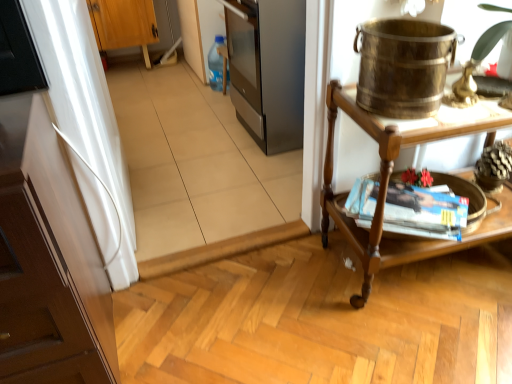
Locate an element on the screen. Image resolution: width=512 pixels, height=384 pixels. white glossy cabinet at left, which is counted as the 1th cabinetry, starting from the right is located at coordinates (48, 260).

Find the location of a particular element. The image size is (512, 384). wooden cabinet at upper left, marked as the 1th cabinetry in a back-to-front arrangement is located at coordinates (124, 24).

From a real-world perspective, is wooden table at right on top of matte brown magazine at right?

Yes, from a real-world perspective, wooden table at right is above matte brown magazine at right.

Can you confirm if wooden table at right is shorter than matte brown magazine at right?

In fact, wooden table at right may be taller than matte brown magazine at right.

From the image's perspective, is wooden table at right under matte brown magazine at right?

No, from the image's perspective, wooden table at right is not beneath matte brown magazine at right.

Between wooden table at right and matte brown magazine at right, which one appears on the left side from the viewer's perspective?

From the viewer's perspective, matte brown magazine at right appears more on the left side.

Can you tell me how much matte brown magazine at right and white glossy cabinet at left, which is the 2th cabinetry from top to bottom, differ in facing direction?

40 degrees.

Where is `the 2nd cabinetry directly above the matte brown magazine at right (from a real-world perspective)`? The height and width of the screenshot is (384, 512). the 2nd cabinetry directly above the matte brown magazine at right (from a real-world perspective) is located at coordinates (48, 260).

Would you say matte brown magazine at right is a long distance from white glossy cabinet at left, acting as the first cabinetry starting from the front?

No, matte brown magazine at right is not far away from white glossy cabinet at left, acting as the first cabinetry starting from the front.

How distant is matte brown magazine at right from white glossy cabinet at left, which is the 2th cabinetry from top to bottom?

matte brown magazine at right and white glossy cabinet at left, which is the 2th cabinetry from top to bottom, are 87.89 centimeters apart.

The height and width of the screenshot is (384, 512). What are the coordinates of `magazine located behind the brass metallic bucket at upper right` in the screenshot? It's located at (424, 211).

In terms of size, does brass metallic bucket at upper right appear bigger or smaller than matte brown magazine at right?

Considering their sizes, brass metallic bucket at upper right takes up more space than matte brown magazine at right.

From the picture: Does brass metallic bucket at upper right turn towards matte brown magazine at right?

No.

From a real-world perspective, is white glossy cabinet at left, which is the 2th cabinetry from top to bottom, physically located above or below matte brown magazine at right?

white glossy cabinet at left, which is the 2th cabinetry from top to bottom, is above matte brown magazine at right.

Is white glossy cabinet at left, the 2th cabinetry from the left, taller or shorter than matte brown magazine at right?

In the image, white glossy cabinet at left, the 2th cabinetry from the left, appears to be taller than matte brown magazine at right.

Is there a large distance between white glossy cabinet at left, acting as the first cabinetry starting from the front, and matte brown magazine at right?

white glossy cabinet at left, acting as the first cabinetry starting from the front, is near matte brown magazine at right, not far away.

In the image, is white glossy cabinet at left, the first cabinetry when ordered from bottom to top, positioned in front of or behind matte brown magazine at right?

white glossy cabinet at left, the first cabinetry when ordered from bottom to top, is in front of matte brown magazine at right.

Is white glossy cabinet at left, which is the 2th cabinetry from top to bottom, located outside wooden cabinet at upper left, which is counted as the second cabinetry, starting from the bottom?

Yes.

At what (x,y) coordinates should I click in order to perform the action: click on cabinetry that is above the white glossy cabinet at left, which is the 2th cabinetry from top to bottom (from the image's perspective). Please return your answer as a coordinate pair (x, y). Looking at the image, I should click on (124, 24).

From a real-world perspective, is white glossy cabinet at left, acting as the first cabinetry starting from the front, positioned under wooden cabinet at upper left, marked as the 1th cabinetry in a back-to-front arrangement, based on gravity?

Incorrect, from a real-world perspective, white glossy cabinet at left, acting as the first cabinetry starting from the front, is higher than wooden cabinet at upper left, marked as the 1th cabinetry in a back-to-front arrangement.

Between white glossy cabinet at left, which is the 2th cabinetry from top to bottom, and wooden cabinet at upper left, which is counted as the second cabinetry, starting from the bottom, which one appears on the right side from the viewer's perspective?

Positioned to the right is white glossy cabinet at left, which is the 2th cabinetry from top to bottom.

Measure the distance between wooden cabinet at upper left, placed as the 1th cabinetry when sorted from top to bottom, and brass metallic bucket at upper right.

wooden cabinet at upper left, placed as the 1th cabinetry when sorted from top to bottom, is 7.70 feet from brass metallic bucket at upper right.

Which is more to the left, wooden cabinet at upper left, the 2th cabinetry when ordered from front to back, or brass metallic bucket at upper right?

From the viewer's perspective, wooden cabinet at upper left, the 2th cabinetry when ordered from front to back, appears more on the left side.

Based on the photo, between wooden cabinet at upper left, positioned as the 2th cabinetry in right-to-left order, and brass metallic bucket at upper right, which one has larger size?

Bigger between the two is wooden cabinet at upper left, positioned as the 2th cabinetry in right-to-left order.

Is matte brown magazine at right far away from wooden cabinet at upper left, marked as the 1th cabinetry in a back-to-front arrangement?

Yes, matte brown magazine at right is far from wooden cabinet at upper left, marked as the 1th cabinetry in a back-to-front arrangement.

From the picture: Is matte brown magazine at right in front of wooden cabinet at upper left, which is counted as the second cabinetry, starting from the bottom?

Yes, matte brown magazine at right is in front of wooden cabinet at upper left, which is counted as the second cabinetry, starting from the bottom.

Which object is thinner, matte brown magazine at right or wooden cabinet at upper left, which appears as the 1th cabinetry when viewed from the left?

matte brown magazine at right.

Does point (352, 202) come behind point (121, 34)?

That is False.

The width and height of the screenshot is (512, 384). In order to click on desk lying in front of the matte brown magazine at right in this screenshot , I will do `click(392, 173)`.

At what (x,y) coordinates should I click in order to perform the action: click on the 2nd cabinetry positioned above the matte brown magazine at right (from a real-world perspective). Please return your answer as a coordinate pair (x, y). Looking at the image, I should click on (48, 260).

Based on their spatial positions, is matte brown magazine at right or wooden table at right further from brass metallic bucket at upper right?

Among the two, matte brown magazine at right is located further to brass metallic bucket at upper right.

From the image, which object appears to be farther from wooden table at right, wooden cabinet at upper left, positioned as the 2th cabinetry in right-to-left order, or brass metallic bucket at upper right?

Among the two, wooden cabinet at upper left, positioned as the 2th cabinetry in right-to-left order, is located further to wooden table at right.

Which object lies further to the anchor point white glossy cabinet at left, which is the 2th cabinetry from top to bottom, brass metallic bucket at upper right or wooden cabinet at upper left, the 2th cabinetry when ordered from front to back?

The object further to white glossy cabinet at left, which is the 2th cabinetry from top to bottom, is wooden cabinet at upper left, the 2th cabinetry when ordered from front to back.

Which object lies further to the anchor point wooden cabinet at upper left, positioned as the 2th cabinetry in right-to-left order, white glossy cabinet at left, the second cabinetry in the back-to-front sequence, or brass metallic bucket at upper right?

brass metallic bucket at upper right is positioned further to the anchor wooden cabinet at upper left, positioned as the 2th cabinetry in right-to-left order.

Looking at the image, which one is located closer to wooden cabinet at upper left, which is counted as the second cabinetry, starting from the bottom, wooden table at right or brass metallic bucket at upper right?

Among the two, wooden table at right is located nearer to wooden cabinet at upper left, which is counted as the second cabinetry, starting from the bottom.

Based on their spatial positions, is white glossy cabinet at left, the second cabinetry in the back-to-front sequence, or brass metallic bucket at upper right further from matte brown magazine at right?

The object further to matte brown magazine at right is white glossy cabinet at left, the second cabinetry in the back-to-front sequence.

Estimate the real-world distances between objects in this image. Which object is closer to brass metallic bucket at upper right, wooden table at right or wooden cabinet at upper left, marked as the 1th cabinetry in a back-to-front arrangement?

wooden table at right.

When comparing their distances from wooden table at right, does matte brown magazine at right or brass metallic bucket at upper right seem closer?

matte brown magazine at right is positioned closer to the anchor wooden table at right.

The width and height of the screenshot is (512, 384). In order to click on magazine positioned between white glossy cabinet at left, which is counted as the 1th cabinetry, starting from the right, and wooden cabinet at upper left, placed as the 1th cabinetry when sorted from top to bottom, from near to far in this screenshot , I will do `click(424, 211)`.

I want to click on appliance between white glossy cabinet at left, the first cabinetry when ordered from bottom to top, and wooden table at right, so click(403, 66).

At what (x,y) coordinates should I click in order to perform the action: click on magazine located between brass metallic bucket at upper right and wooden cabinet at upper left, positioned as the 2th cabinetry in right-to-left order, in the depth direction. Please return your answer as a coordinate pair (x, y). Looking at the image, I should click on (424, 211).

Find the location of a particular element. magazine situated between white glossy cabinet at left, which is counted as the 1th cabinetry, starting from the right, and wooden table at right from left to right is located at coordinates (424, 211).